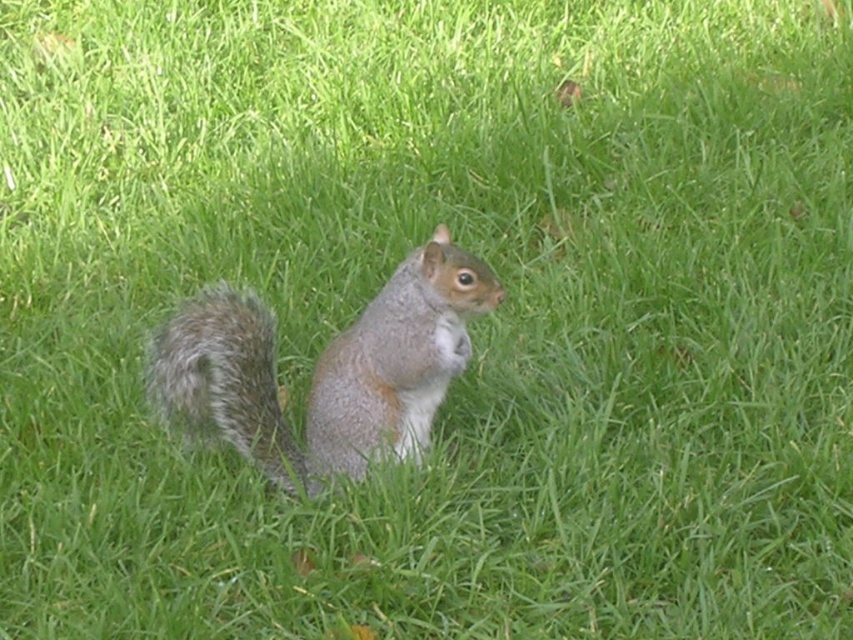
Can you confirm if gray furry squirrel at center is smaller than fuzzy gray tail at center?

Actually, gray furry squirrel at center might be larger than fuzzy gray tail at center.

Image resolution: width=853 pixels, height=640 pixels. What are the coordinates of `gray furry squirrel at center` in the screenshot? It's located at (323, 369).